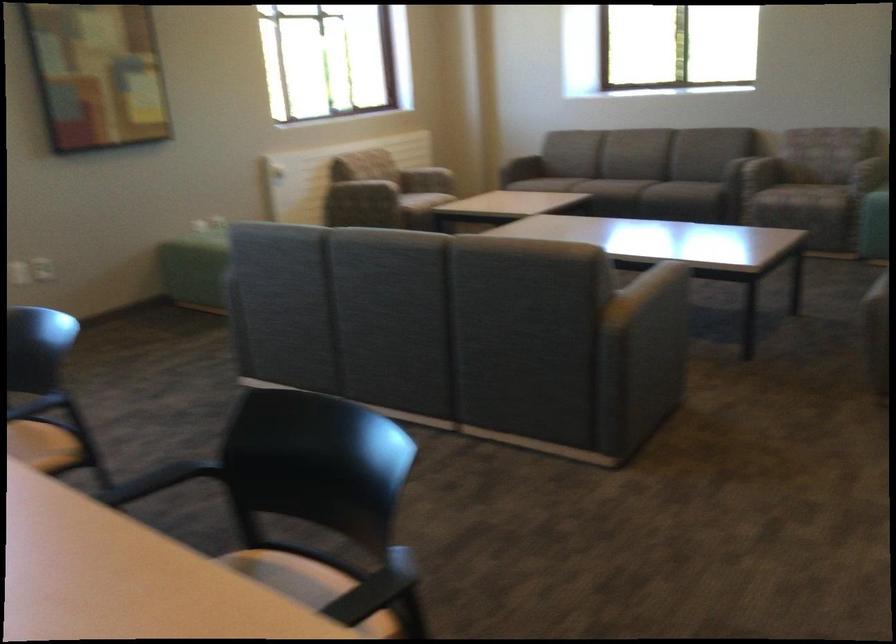
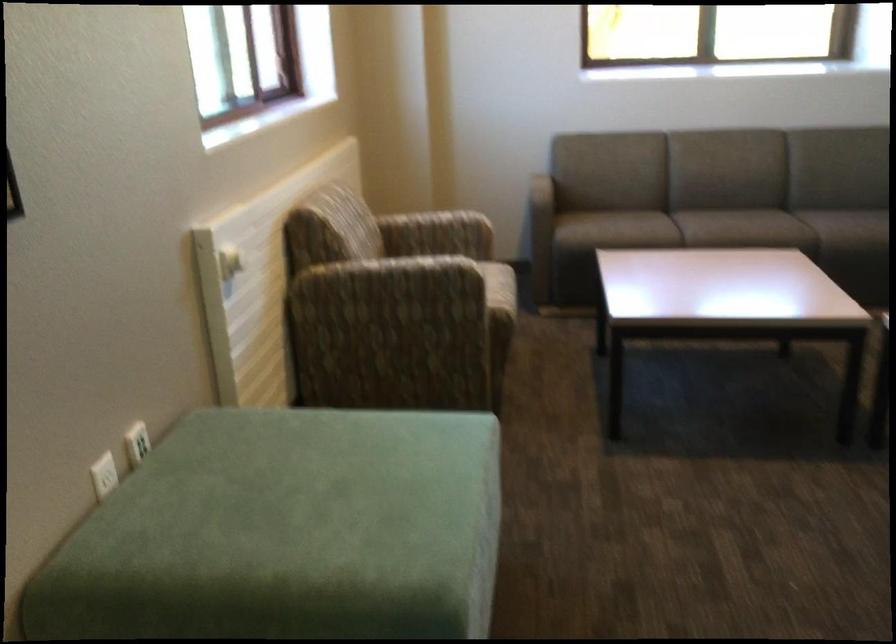
The point at (209,216) is marked in the first image. Where is the corresponding point in the second image?

(136, 442)